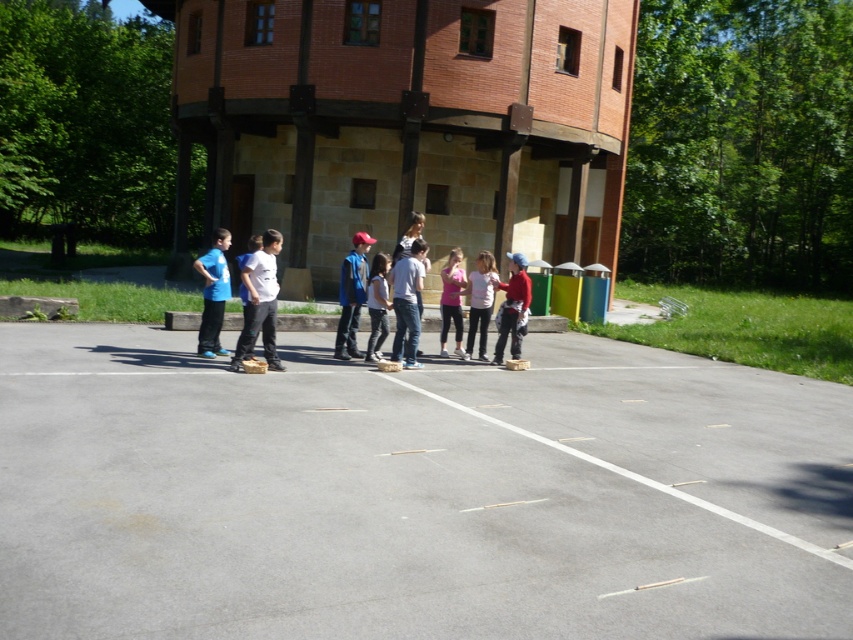
Locate an element on the screen. This screenshot has width=853, height=640. asphalt at center is located at coordinates (415, 493).

Does asphalt at center have a greater height compared to white matte shirt at center?

No.

Is point (339, 376) positioned behind point (465, 349)?

No, it is not.

You are a GUI agent. You are given a task and a screenshot of the screen. Output one action in this format:
    pyautogui.click(x=<x>, y=<y>)
    Task: Click on the asphalt at center
    This screenshot has height=640, width=853.
    Given the screenshot: What is the action you would take?
    pyautogui.click(x=415, y=493)

Between white matte shirt at center and smooth white line at center, which one appears on the right side from the viewer's perspective?

From the viewer's perspective, white matte shirt at center appears more on the right side.

Does white matte shirt at center appear under smooth white line at center?

No.

The image size is (853, 640). In order to click on white matte shirt at center in this screenshot , I will do `click(480, 301)`.

Which of these two, matte blue shirt at left or matte red helmet at center, stands shorter?

With less height is matte red helmet at center.

Identify the location of matte blue shirt at left. (213, 292).